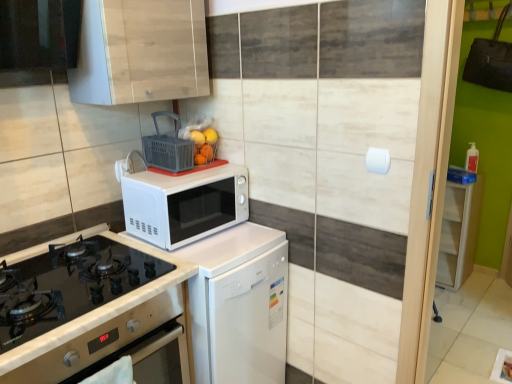
Question: From a real-world perspective, does black glass gas stove at lower left sit lower than white matte microwave at center?

Choices:
 (A) no
 (B) yes

Answer: (B)

Question: Is black glass gas stove at lower left shorter than white matte microwave at center?

Choices:
 (A) yes
 (B) no

Answer: (A)

Question: Can you confirm if black glass gas stove at lower left is thinner than white matte microwave at center?

Choices:
 (A) yes
 (B) no

Answer: (B)

Question: Is black glass gas stove at lower left in front of white matte microwave at center?

Choices:
 (A) yes
 (B) no

Answer: (A)

Question: Does black glass gas stove at lower left come behind white matte microwave at center?

Choices:
 (A) no
 (B) yes

Answer: (A)

Question: Considering the relative sizes of black glass gas stove at lower left and white matte microwave at center in the image provided, is black glass gas stove at lower left taller than white matte microwave at center?

Choices:
 (A) yes
 (B) no

Answer: (B)

Question: From the image's perspective, would you say white plastic electric outlet at upper center is shown under wooden cabinet at upper center, which ranks as the first cabinetry in top-to-bottom order?

Choices:
 (A) yes
 (B) no

Answer: (A)

Question: Does white plastic electric outlet at upper center have a greater height compared to wooden cabinet at upper center, which ranks as the first cabinetry in top-to-bottom order?

Choices:
 (A) yes
 (B) no

Answer: (B)

Question: Is white plastic electric outlet at upper center far away from wooden cabinet at upper center, which is the first cabinetry in left-to-right order?

Choices:
 (A) yes
 (B) no

Answer: (B)

Question: Can you see white plastic electric outlet at upper center touching wooden cabinet at upper center, which ranks as the first cabinetry in top-to-bottom order?

Choices:
 (A) yes
 (B) no

Answer: (B)

Question: Is white plastic electric outlet at upper center to the left of wooden cabinet at upper center, which ranks as the 1th cabinetry in front-to-back order, from the viewer's perspective?

Choices:
 (A) no
 (B) yes

Answer: (B)

Question: Can you confirm if white plastic electric outlet at upper center is thinner than wooden cabinet at upper center, which ranks as the 1th cabinetry in front-to-back order?

Choices:
 (A) yes
 (B) no

Answer: (A)

Question: Is white wood cabinet at right, the 2th cabinetry positioned from the left, positioned before plastic basket at upper center?

Choices:
 (A) yes
 (B) no

Answer: (B)